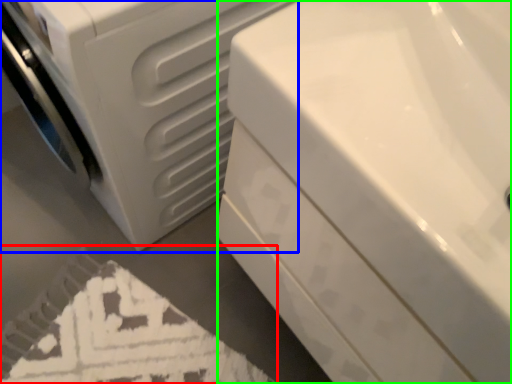
Question: Estimate the real-world distances between objects in this image. Which object is closer to bath mat (highlighted by a red box), washing machine (highlighted by a blue box) or bath (highlighted by a green box)?

Choices:
 (A) washing machine
 (B) bath

Answer: (A)